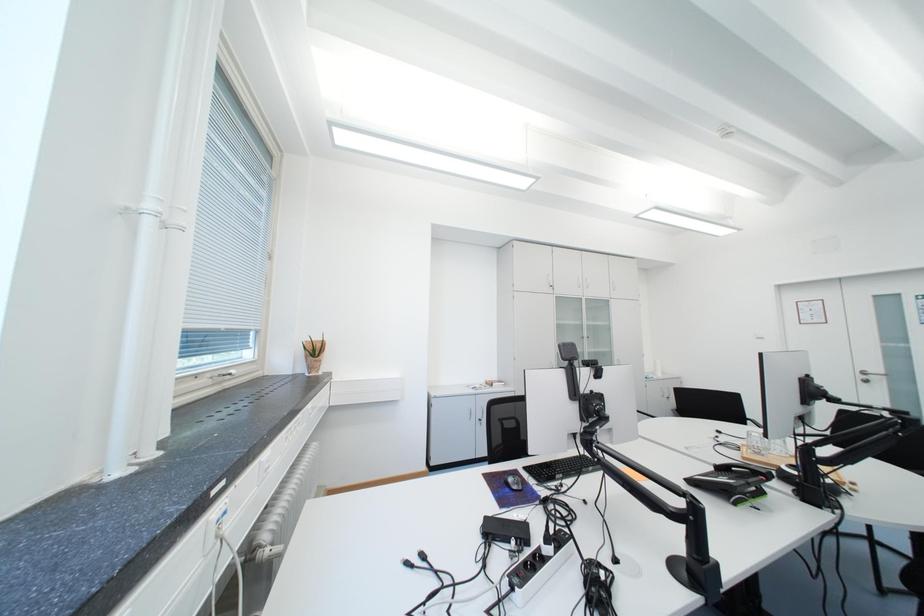
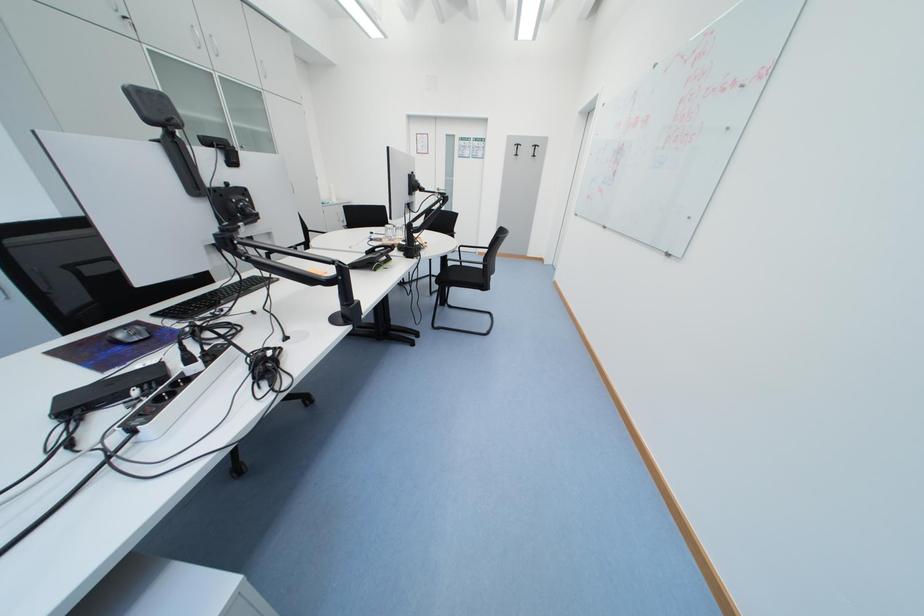
The first image is from the beginning of the video and the second image is from the end. How did the camera likely rotate when shooting the video?

The camera's rotation is toward right-down.